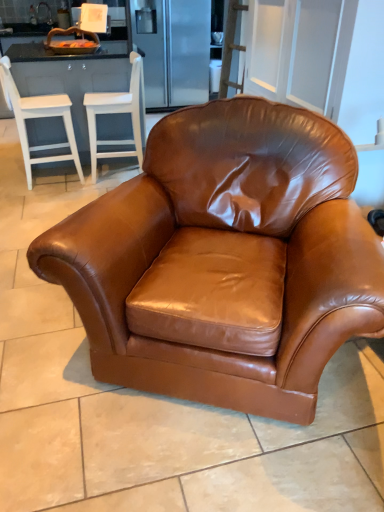
Question: Is white wood barstools at left smaller than brown leather armchair at center, which ranks as the first chair in back-to-front order?

Choices:
 (A) no
 (B) yes

Answer: (A)

Question: Considering the relative positions of white wood barstools at left and brown leather armchair at center, the third chair in the front-to-back sequence, in the image provided, is white wood barstools at left to the left of brown leather armchair at center, the third chair in the front-to-back sequence, from the viewer's perspective?

Choices:
 (A) no
 (B) yes

Answer: (B)

Question: Considering the relative positions of white wood barstools at left and brown leather armchair at center, the third chair in the front-to-back sequence, in the image provided, is white wood barstools at left in front of brown leather armchair at center, the third chair in the front-to-back sequence,?

Choices:
 (A) no
 (B) yes

Answer: (A)

Question: Does white wood barstools at left have a greater height compared to brown leather armchair at center, the third chair in the front-to-back sequence?

Choices:
 (A) no
 (B) yes

Answer: (A)

Question: Does white wood barstools at left have a larger size compared to brown leather armchair at center, positioned as the second chair in right-to-left order?

Choices:
 (A) no
 (B) yes

Answer: (B)

Question: Considering the relative sizes of white wood barstools at left and brown leather armchair at center, positioned as the second chair in right-to-left order, in the image provided, is white wood barstools at left thinner than brown leather armchair at center, positioned as the second chair in right-to-left order,?

Choices:
 (A) yes
 (B) no

Answer: (B)

Question: Is white wood bar stool at left, positioned as the 3th chair in right-to-left order, positioned far away from white wood barstools at left?

Choices:
 (A) yes
 (B) no

Answer: (B)

Question: Does white wood bar stool at left, arranged as the second chair when viewed from the front, turn towards white wood barstools at left?

Choices:
 (A) yes
 (B) no

Answer: (B)

Question: Is white wood bar stool at left, arranged as the second chair when viewed from the front, bigger than white wood barstools at left?

Choices:
 (A) no
 (B) yes

Answer: (A)

Question: Considering the relative positions of white wood bar stool at left, arranged as the second chair when viewed from the front, and white wood barstools at left in the image provided, is white wood bar stool at left, arranged as the second chair when viewed from the front, to the left of white wood barstools at left from the viewer's perspective?

Choices:
 (A) yes
 (B) no

Answer: (A)

Question: Would you say white wood bar stool at left, positioned as the 3th chair in right-to-left order, is outside white wood barstools at left?

Choices:
 (A) yes
 (B) no

Answer: (A)

Question: Considering the relative sizes of white wood bar stool at left, arranged as the second chair when viewed from the front, and white wood barstools at left in the image provided, is white wood bar stool at left, arranged as the second chair when viewed from the front, smaller than white wood barstools at left?

Choices:
 (A) no
 (B) yes

Answer: (B)

Question: Is brown leather armchair at center, the third chair in the front-to-back sequence, closer to the viewer compared to saddle brown leather armchair at center, which is counted as the third chair, starting from the left?

Choices:
 (A) no
 (B) yes

Answer: (A)